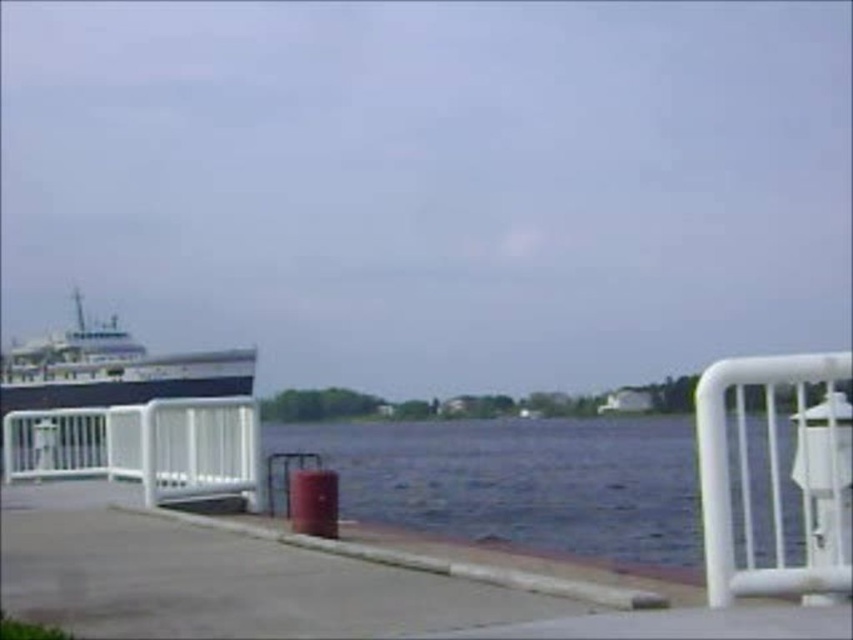
Can you confirm if gray concrete pavement at center is bigger than white plastic rail at right?

Actually, gray concrete pavement at center might be smaller than white plastic rail at right.

Who is more forward, [70,529] or [709,560]?

Point [709,560]

Is point (247, 628) farther from camera compared to point (718, 433)?

Yes.

Find the location of `gray concrete pavement at center`. gray concrete pavement at center is located at coordinates (218, 579).

You are a GUI agent. You are given a task and a screenshot of the screen. Output one action in this format:
    pyautogui.click(x=<x>, y=<y>)
    Task: Click on the gray concrete pavement at center
    This screenshot has width=853, height=640.
    Given the screenshot: What is the action you would take?
    pyautogui.click(x=218, y=579)

Can you confirm if gray concrete pavement at center is taller than white metal fence at left?

No.

Where is `gray concrete pavement at center`? The height and width of the screenshot is (640, 853). gray concrete pavement at center is located at coordinates pyautogui.click(x=218, y=579).

Who is more distant from viewer, (96, 472) or (799, 448)?

The point (96, 472) is behind.

Can you confirm if white metal fence at left is positioned to the right of white plastic rail at right?

No, white metal fence at left is not to the right of white plastic rail at right.

Locate an element on the screen. This screenshot has width=853, height=640. white metal fence at left is located at coordinates (142, 445).